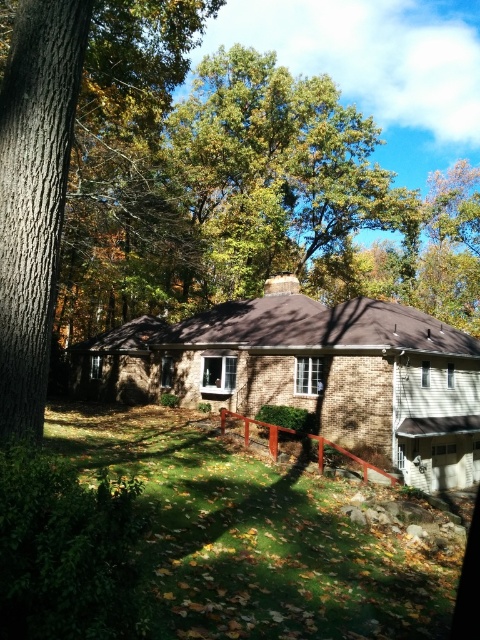
Question: Is green grass at lower center smaller than smooth brown bark at left?

Choices:
 (A) yes
 (B) no

Answer: (B)

Question: Can you confirm if green grass at lower center is thinner than smooth brown bark at left?

Choices:
 (A) no
 (B) yes

Answer: (A)

Question: Which point appears closest to the camera in this image?

Choices:
 (A) (251, 497)
 (B) (14, 344)

Answer: (B)

Question: Is green grass at lower center positioned before smooth brown bark at left?

Choices:
 (A) yes
 (B) no

Answer: (A)